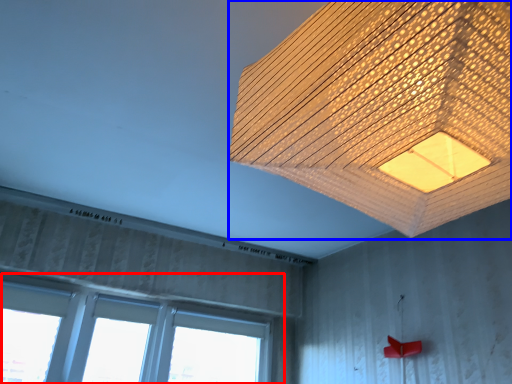
Question: Which of the following is the closest to the observer, window (highlighted by a red box) or lamp (highlighted by a blue box)?

Choices:
 (A) window
 (B) lamp

Answer: (B)